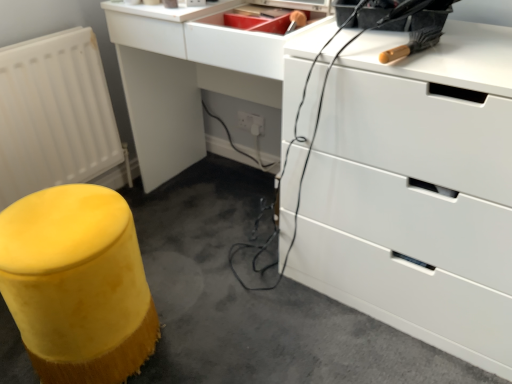
The height and width of the screenshot is (384, 512). In order to click on free spot to the right of white matte radiator at lower left in this screenshot , I will do `click(167, 218)`.